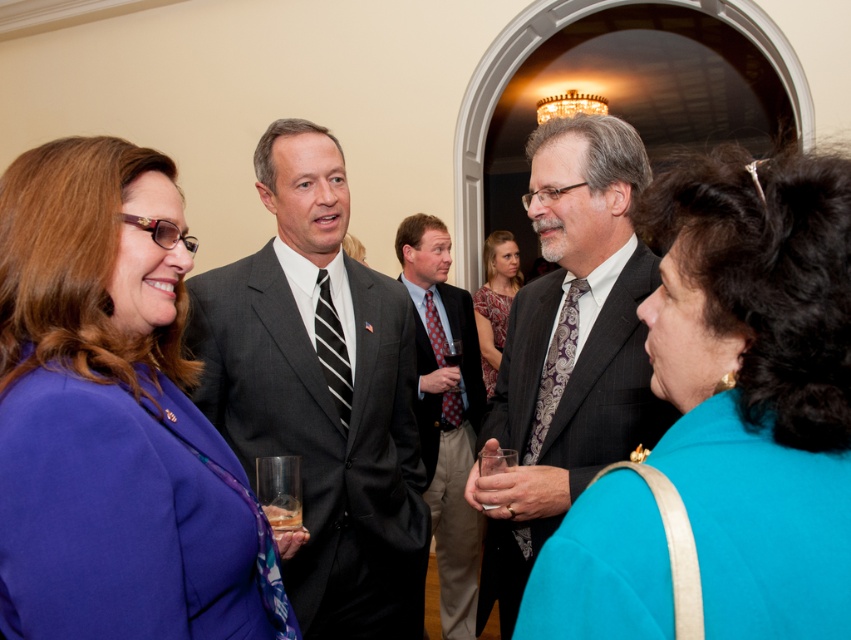
Which of these two, dark gray suit at center or patterned silk tie at center, stands taller?

dark gray suit at center is taller.

Between dark gray suit at center and patterned silk tie at center, which one is positioned lower?

dark gray suit at center is lower down.

You are a GUI agent. You are given a task and a screenshot of the screen. Output one action in this format:
    pyautogui.click(x=<x>, y=<y>)
    Task: Click on the dark gray suit at center
    
    Given the screenshot: What is the action you would take?
    pyautogui.click(x=568, y=348)

You are a GUI agent. You are given a task and a screenshot of the screen. Output one action in this format:
    pyautogui.click(x=<x>, y=<y>)
    Task: Click on the dark gray suit at center
    
    Given the screenshot: What is the action you would take?
    click(x=568, y=348)

Which is below, dark gray suit at center or patterned tie at center?

patterned tie at center is below.

How far apart are dark gray suit at center and patterned tie at center?

dark gray suit at center is 3.95 feet from patterned tie at center.

Between point (632, 276) and point (453, 628), which one is positioned behind?

The point (453, 628) is more distant.

At what (x,y) coordinates should I click in order to perform the action: click on dark gray suit at center. Please return your answer as a coordinate pair (x, y). This screenshot has height=640, width=851. Looking at the image, I should click on (568, 348).

Can you confirm if matte gray suit at center is positioned to the left of dark gray suit at center?

Correct, you'll find matte gray suit at center to the left of dark gray suit at center.

Between matte gray suit at center and dark gray suit at center, which one appears on the left side from the viewer's perspective?

matte gray suit at center

This screenshot has width=851, height=640. What are the coordinates of `matte gray suit at center` in the screenshot? It's located at (321, 392).